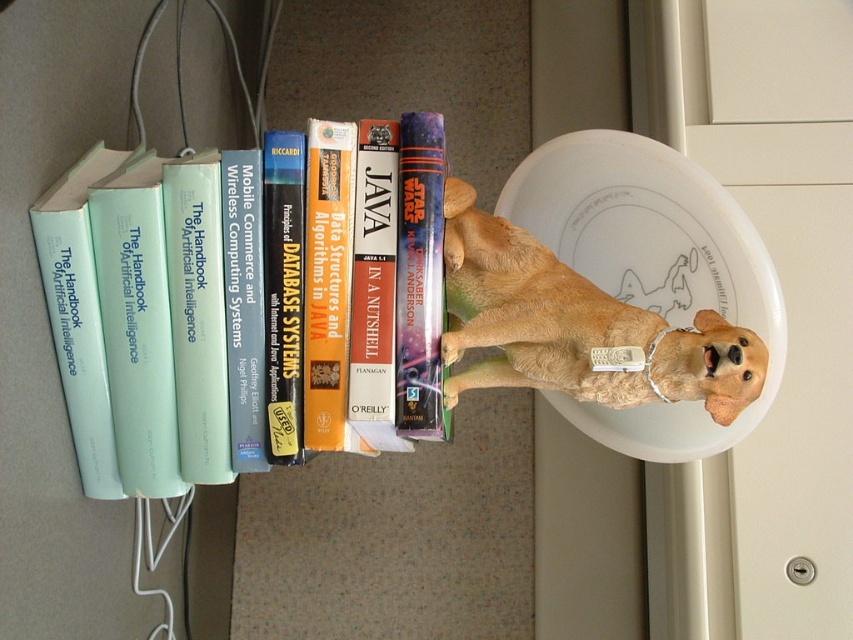
Please look at the image described. There is a point marked at coordinates (x=576, y=326). Which object from the list below is located at this point? Choose from the following options. A. golden retriever figurine B. technical book on artificial intelligence C. wireless computing systems book D. database systems book

The point at coordinates (x=576, y=326) marks the golden fur dog at center, which corresponds to the golden retriever figurine. The correct answer is A.

You are organizing a bookshelf and see the light blue paperback book at left and the golden fur dog at center. Which object is positioned higher on the shelf?

The light blue paperback book at left is positioned higher on the shelf than the golden fur dog at center.

You need to place a 10 cm wide notebook between the light blue paperback book at left and the hardcover book at center. Can you fit it there?

The light blue paperback book at left is wider than the hardcover book at center. Therefore, the space between them might be sufficient to fit a 10 cm wide notebook, but since the exact distance isn